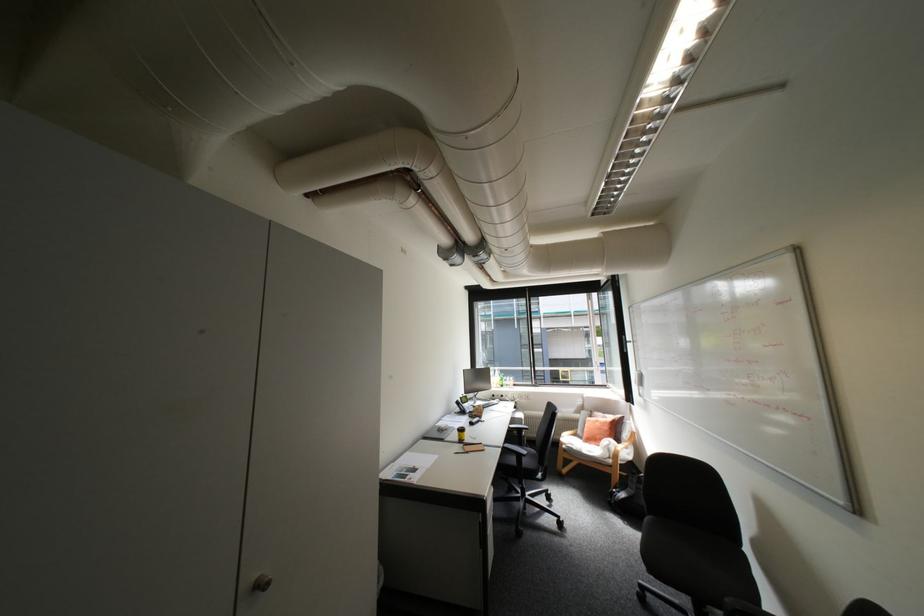
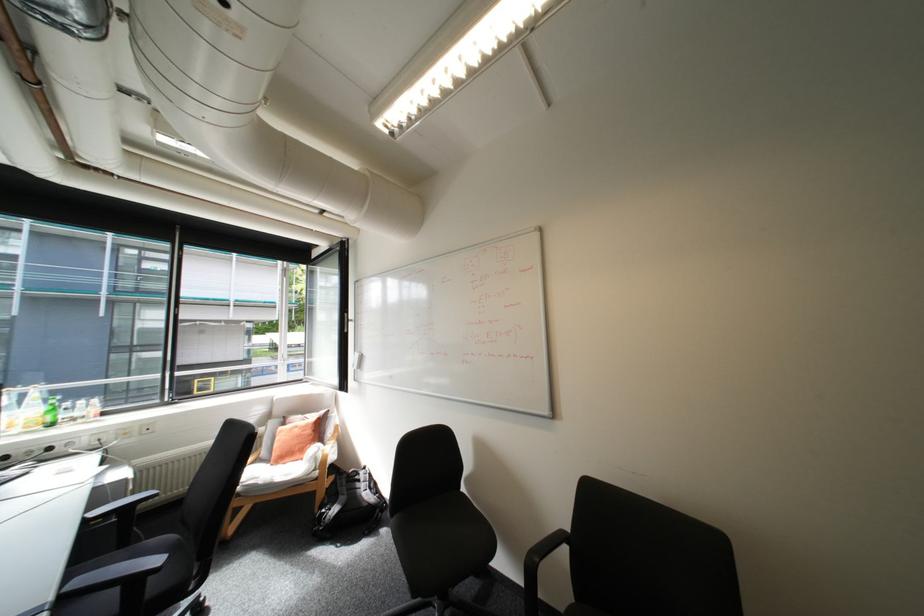
The point at (x=508, y=379) is marked in the first image. Where is the corresponding point in the second image?

(55, 408)